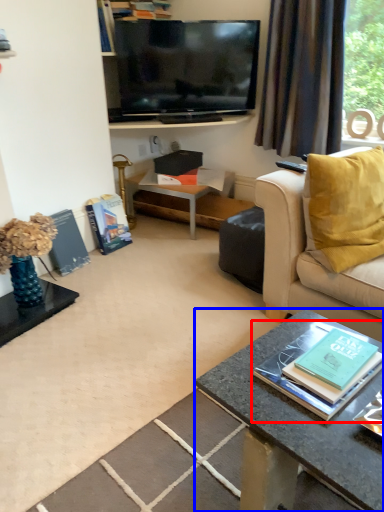
Question: Which object appears closest to the camera in this image, book (highlighted by a red box) or desk (highlighted by a blue box)?

Choices:
 (A) book
 (B) desk

Answer: (B)